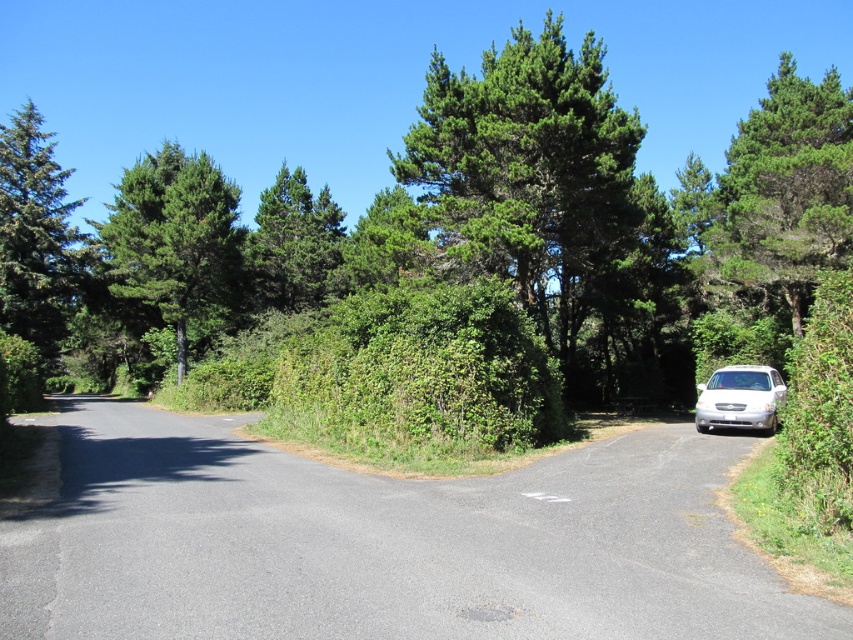
You are standing at the point labeled as point (549, 202) in the image. Based on the scene description, what is the nearest object to you?

The nearest object to you is the green leafy tree at center, as the point (549, 202) is located on it.

You are standing on the paved road and see the green leafy tree at center and the green leafy tree at left. Which tree is closer to the right edge of the road?

The green leafy tree at center is positioned on the right side of green leafy tree at left, so the green leafy tree at center is closer to the right edge of the road.